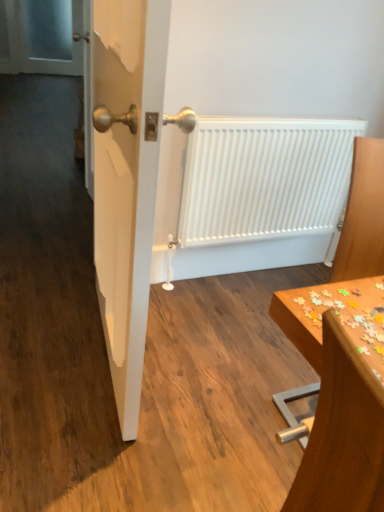
At what (x,y) coordinates should I click in order to perform the action: click on vacant area that is in front of white glossy door at center. Please return your answer as a coordinate pair (x, y). Image resolution: width=384 pixels, height=512 pixels. Looking at the image, I should click on (92, 438).